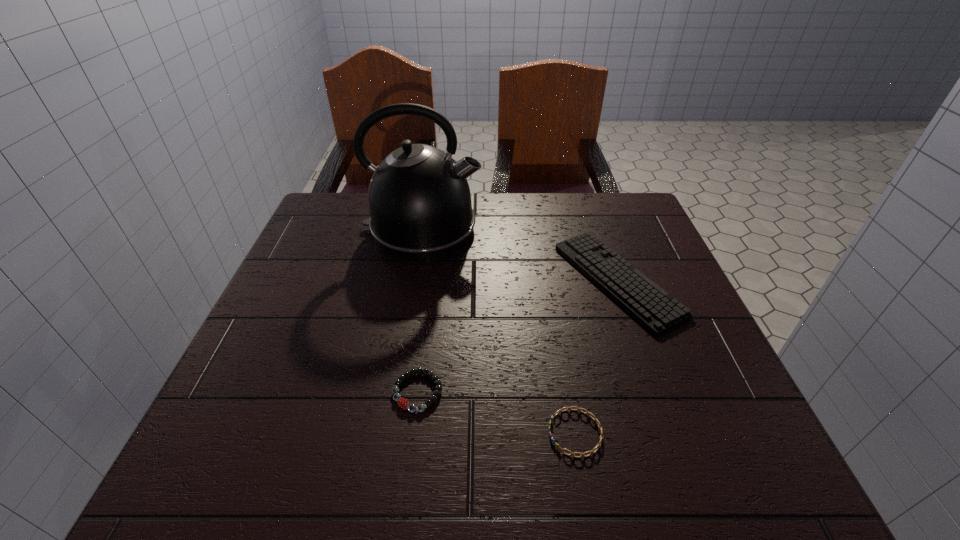
At what (x,y) coordinates should I click in order to perform the action: click on the tallest object. Please return your answer as a coordinate pair (x, y). This screenshot has height=540, width=960. Looking at the image, I should click on (419, 199).

Image resolution: width=960 pixels, height=540 pixels. Find the location of `computer keyboard`. computer keyboard is located at coordinates coord(654,308).

The image size is (960, 540). Identify the location of the left bracelet. (402, 402).

This screenshot has width=960, height=540. Find the location of `the second shortest object`. the second shortest object is located at coordinates (402, 402).

Image resolution: width=960 pixels, height=540 pixels. Find the location of `the shorter bracelet`. the shorter bracelet is located at coordinates (598, 446).

The height and width of the screenshot is (540, 960). I want to click on the right bracelet, so click(x=598, y=446).

Locate an element on the screen. This screenshot has width=960, height=540. free space located 0.310m on the spout of the kettle is located at coordinates (599, 229).

This screenshot has width=960, height=540. Find the location of `free space located 0.100m on the left of the computer keyboard`. free space located 0.100m on the left of the computer keyboard is located at coordinates (518, 280).

Find the location of a particular element. Image resolution: width=960 pixels, height=540 pixels. vacant position located on the left of the left bracelet is located at coordinates (308, 392).

This screenshot has width=960, height=540. Identify the location of vacant space located 0.130m on the surface of the shorter bracelet showing star-shaped elements. (469, 433).